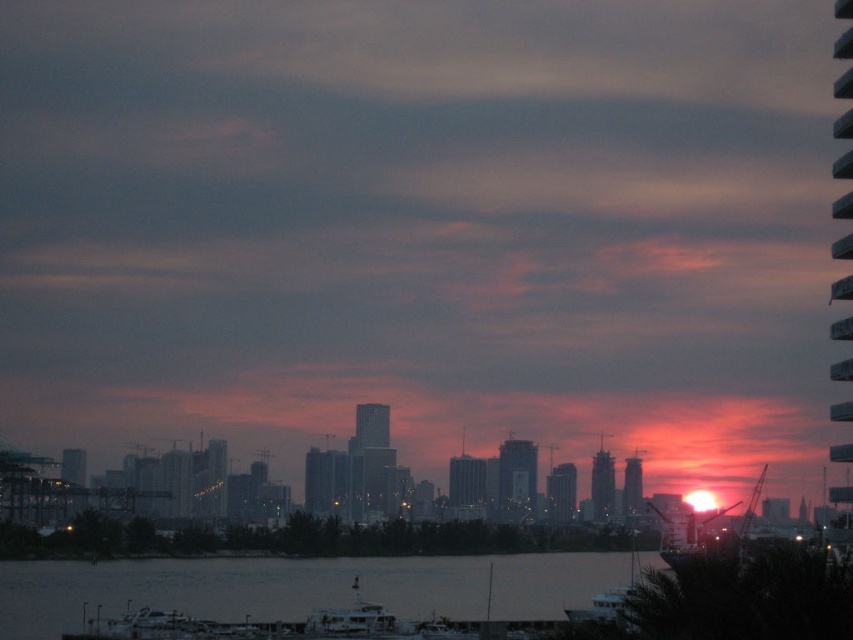
Who is higher up, silvery water at lower center or metallic silver boat at lower center?

metallic silver boat at lower center is above.

Based on the photo, does silvery water at lower center have a larger size compared to metallic silver boat at lower center?

Yes, silvery water at lower center is bigger than metallic silver boat at lower center.

At what (x,y) coordinates should I click in order to perform the action: click on silvery water at lower center. Please return your answer as a coordinate pair (x, y). Image resolution: width=853 pixels, height=640 pixels. Looking at the image, I should click on (300, 588).

Locate an element on the screen. Image resolution: width=853 pixels, height=640 pixels. silvery water at lower center is located at coordinates (300, 588).